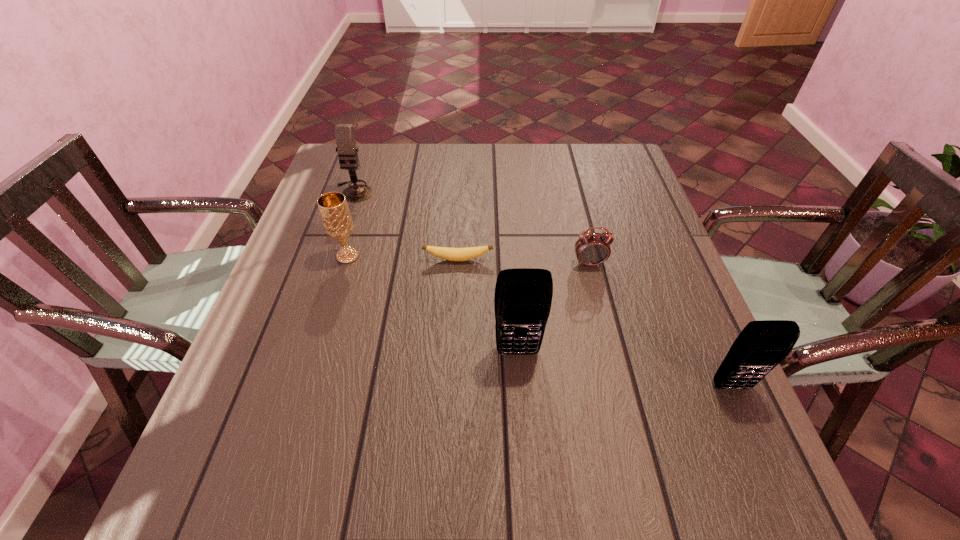
Observe the arrangement of all cellular telephones in the image. To keep them evenly spaced, where would you place another cellular telephone on the left? Please locate a free space. Please provide its 2D coordinates. Your answer should be formatted as a tuple, i.e. [(x, y)], where the tuple contains the x and y coordinates of a point satisfying the conditions above.

[(328, 322)]